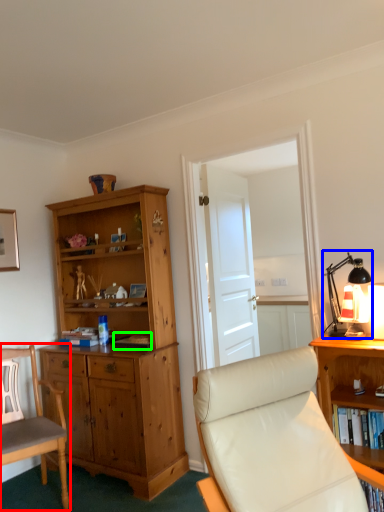
Question: Based on their relative distances, which object is farther from chair (highlighted by a red box)? Choose from table lamp (highlighted by a blue box) and book (highlighted by a green box).

Choices:
 (A) table lamp
 (B) book

Answer: (A)